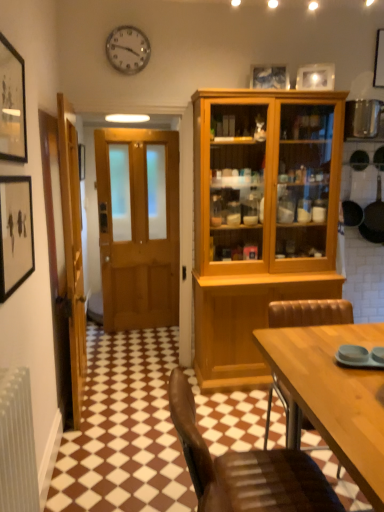
You are a GUI agent. You are given a task and a screenshot of the screen. Output one action in this format:
    pyautogui.click(x=<x>, y=<y>)
    Task: Click on the free space on the front side of wooden door at left, which ranks as the second door in right-to-left order
    The width and height of the screenshot is (384, 512).
    Given the screenshot: What is the action you would take?
    pyautogui.click(x=100, y=441)